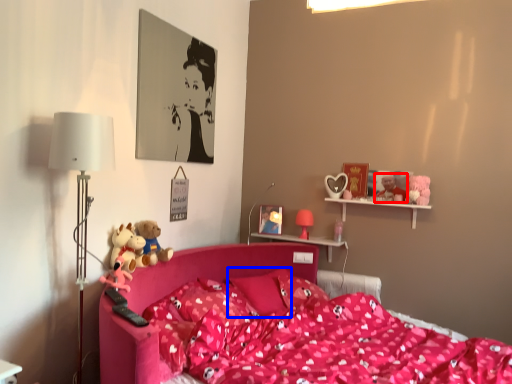
Question: Which point is further to the camera, toy (highlighted by a red box) or pillow (highlighted by a blue box)?

Choices:
 (A) toy
 (B) pillow

Answer: (A)